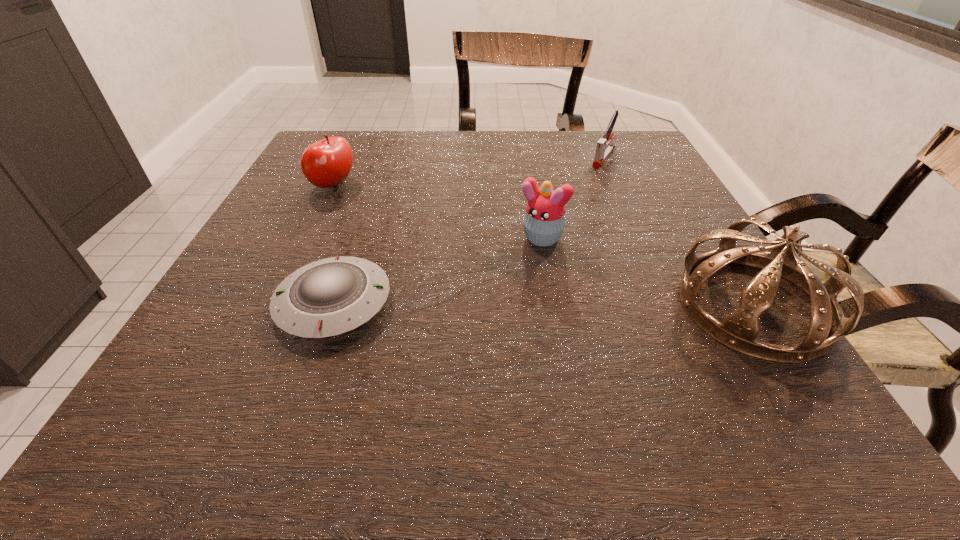
At what (x,y) coordinates should I click in order to perform the action: click on blank space at the far edge. Please return your answer as a coordinate pair (x, y). The height and width of the screenshot is (540, 960). Looking at the image, I should click on 573,141.

Find the location of a particular element. This screenshot has height=540, width=960. vacant space at the near edge of the desktop is located at coordinates (618, 339).

You are a GUI agent. You are given a task and a screenshot of the screen. Output one action in this format:
    pyautogui.click(x=<x>, y=<y>)
    Task: Click on the vacant space at the left edge of the desktop
    The height and width of the screenshot is (540, 960).
    Given the screenshot: What is the action you would take?
    pyautogui.click(x=289, y=194)

The width and height of the screenshot is (960, 540). Find the location of `vacant space at the right edge of the desktop`. vacant space at the right edge of the desktop is located at coordinates point(657,178).

Locate an element on the screen. The width and height of the screenshot is (960, 540). free space at the far left corner of the desktop is located at coordinates (356, 156).

The height and width of the screenshot is (540, 960). In the image, there is a desktop. In order to click on vacant space at the near left corner in this screenshot , I will do `click(262, 342)`.

You are a GUI agent. You are given a task and a screenshot of the screen. Output one action in this format:
    pyautogui.click(x=<x>, y=<y>)
    Task: Click on the vacant space at the far right corner
    The image size is (960, 540).
    Given the screenshot: What is the action you would take?
    pyautogui.click(x=636, y=171)

The image size is (960, 540). What are the coordinates of `free space between the tiara and the stapler` in the screenshot? It's located at (679, 232).

You are a GUI agent. You are given a task and a screenshot of the screen. Output one action in this format:
    pyautogui.click(x=<x>, y=<y>)
    Task: Click on the free space between the cupcake and the tiara
    
    Given the screenshot: What is the action you would take?
    pyautogui.click(x=646, y=272)

This screenshot has width=960, height=540. Find the location of `vacant region between the third nearest object and the shortest object`. vacant region between the third nearest object and the shortest object is located at coordinates (436, 271).